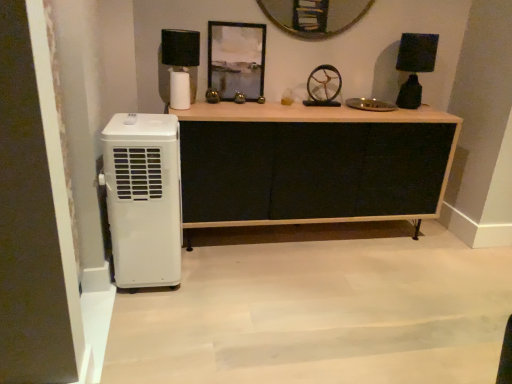
Image resolution: width=512 pixels, height=384 pixels. I want to click on vacant space in front of metallic gold wheel at center, so click(328, 111).